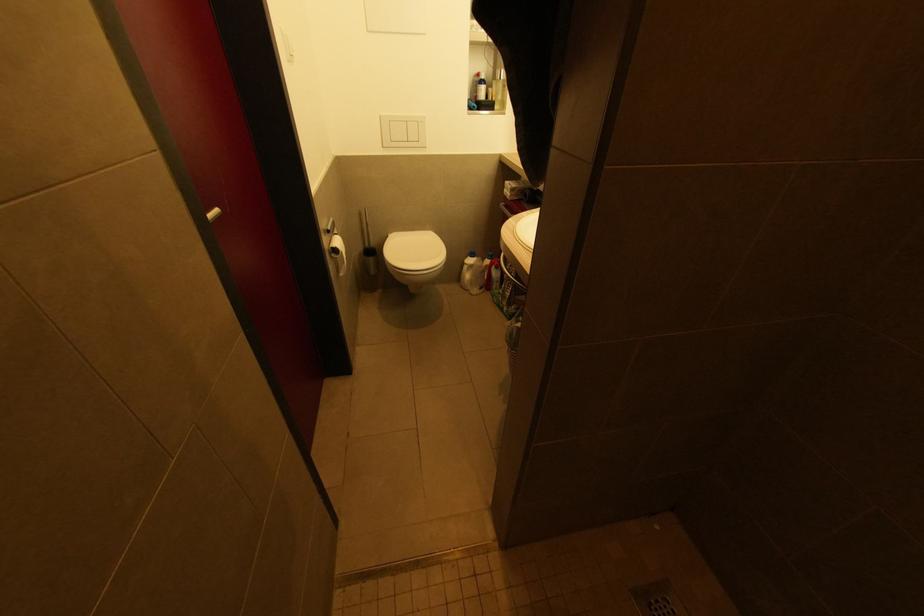
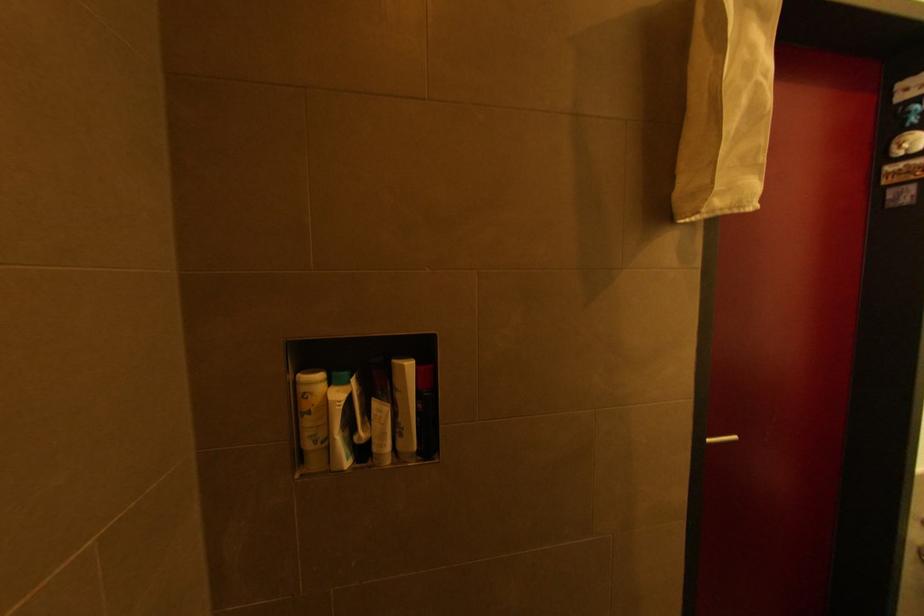
Question: The first image is from the beginning of the video and the second image is from the end. How did the camera likely rotate when shooting the video?

Choices:
 (A) Left
 (B) Right
 (C) Up
 (D) Down

Answer: (A)